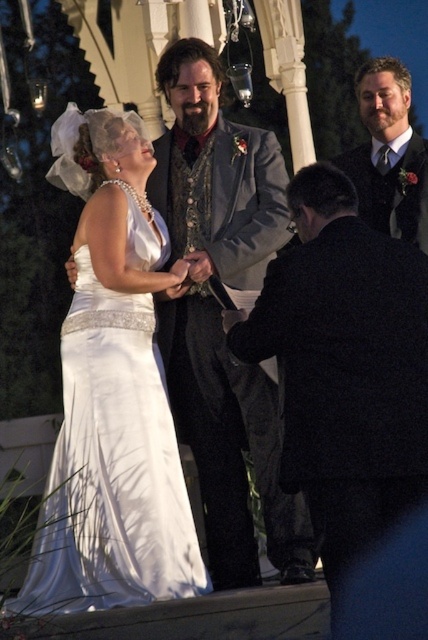
Does point (130, 291) come in front of point (311, 426)?

No, it is not.

Is point (148, 444) more distant than point (383, 456)?

Yes, it is.

Image resolution: width=428 pixels, height=640 pixels. In order to click on white satin dress at center in this screenshot , I will do `click(112, 397)`.

Between black wool coat at lower right and shiny black suit at center, which one appears on the right side from the viewer's perspective?

shiny black suit at center

At what (x,y) coordinates should I click in order to perform the action: click on black wool coat at lower right. Please return your answer as a coordinate pair (x, y). Image resolution: width=428 pixels, height=640 pixels. Looking at the image, I should click on (344, 365).

Can you confirm if white satin dress at center is taller than matte gray vest at center?

Incorrect, white satin dress at center's height is not larger of matte gray vest at center's.

Between white satin dress at center and matte gray vest at center, which one has more height?

matte gray vest at center is taller.

Between point (83, 381) and point (238, 198), which one is positioned behind?

The point (238, 198) is more distant.

In order to click on white satin dress at center in this screenshot , I will do `click(112, 397)`.